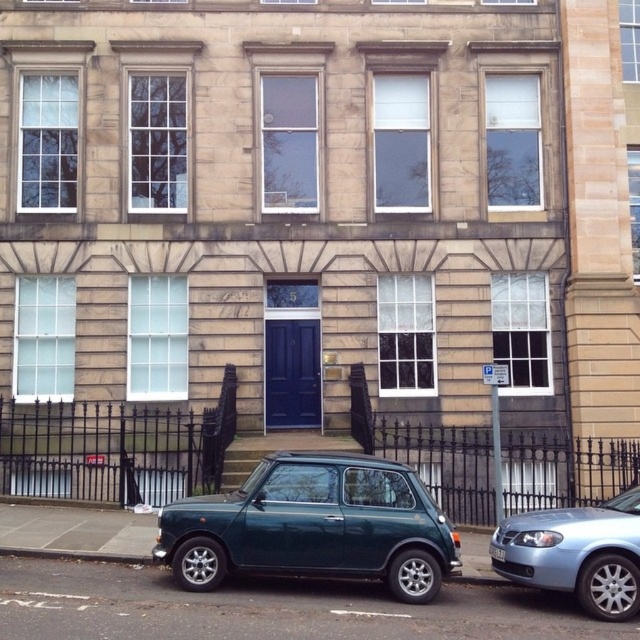
Question: In this image, where is light blue metallic sedan at lower right located relative to matte dark blue door at center?

Choices:
 (A) below
 (B) above

Answer: (A)

Question: Is light blue metallic sedan at lower right behind matte dark blue door at center?

Choices:
 (A) no
 (B) yes

Answer: (A)

Question: Is light blue metallic sedan at lower right smaller than matte dark blue door at center?

Choices:
 (A) yes
 (B) no

Answer: (B)

Question: Among these points, which one is farthest from the camera?

Choices:
 (A) (490, 545)
 (B) (282, 486)
 (C) (269, 424)
 (D) (552, 576)

Answer: (C)

Question: Based on their relative distances, which object is farther from the white plastic license plate at center?

Choices:
 (A) matte dark blue door at center
 (B) light blue metallic sedan at lower right

Answer: (A)

Question: Among these objects, which one is farthest from the camera?

Choices:
 (A) white plastic license plate at center
 (B) teal glossy hatchback at lower center
 (C) matte dark blue door at center
 (D) light blue metallic sedan at lower right

Answer: (C)